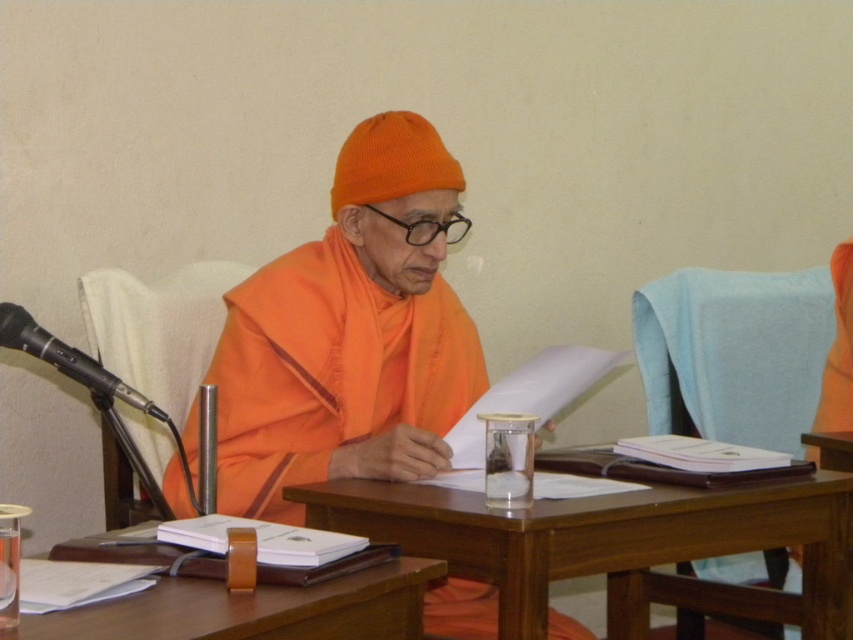
Question: Does wooden table at center appear under blue fabric chair at right?

Choices:
 (A) no
 (B) yes

Answer: (B)

Question: Is wooden table at center below blue fabric chair at right?

Choices:
 (A) yes
 (B) no

Answer: (A)

Question: Which object is the farthest from the wooden table at center?

Choices:
 (A) white fabric chair at left
 (B) orange clothed figure at center
 (C) wooden at center

Answer: (A)

Question: Which object is farther from the camera taking this photo?

Choices:
 (A) blue fabric chair at right
 (B) black plastic microphone at left
 (C) orange clothed figure at center

Answer: (A)

Question: Is the position of blue fabric chair at right more distant than that of wooden at center?

Choices:
 (A) no
 (B) yes

Answer: (B)

Question: Which object appears closest to the camera in this image?

Choices:
 (A) white fabric chair at left
 (B) wooden table at center

Answer: (B)